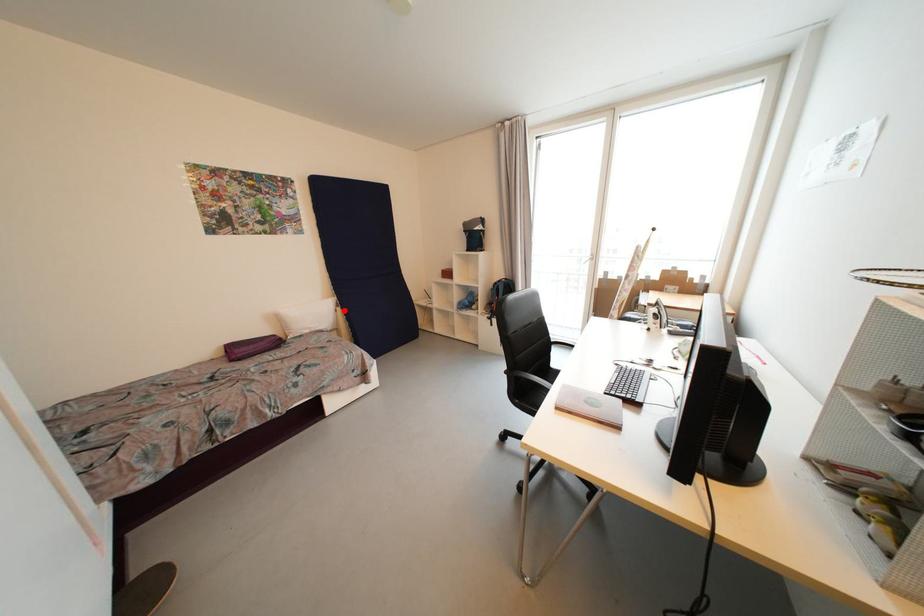
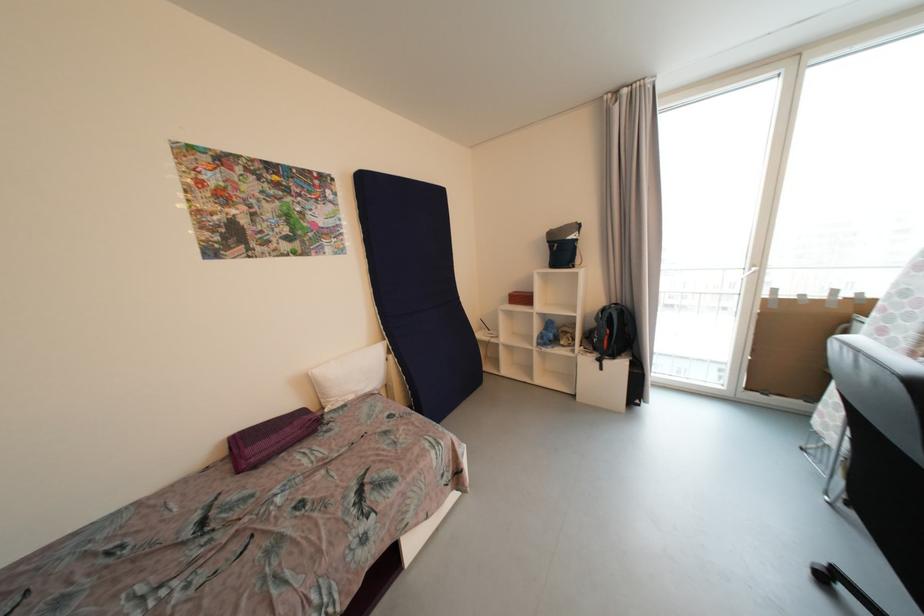
Question: I am providing you with two images of the same scene from different viewpoints. Image1 has a red point marked. In image2, the corresponding 3D location appears at what relative position? Reply with the corresponding letter.

Choices:
 (A) Closer
 (B) Farther

Answer: (A)